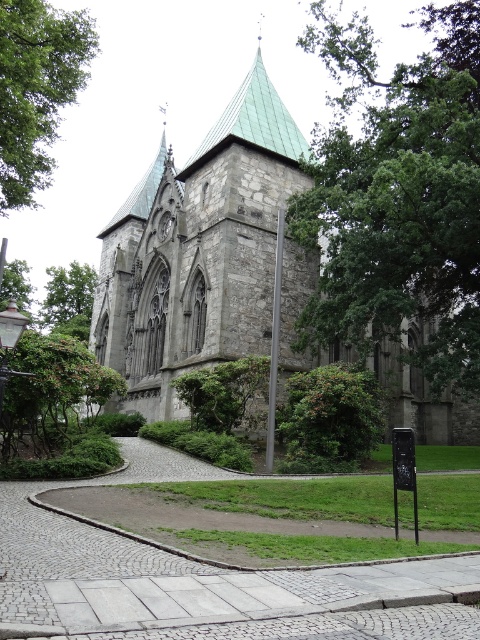
Question: Which point is farther to the camera?

Choices:
 (A) (6, 97)
 (B) (62, 376)
 (C) (333, 422)

Answer: (C)

Question: Does green leafy tree at upper right appear under green leafy tree at lower left?

Choices:
 (A) no
 (B) yes

Answer: (A)

Question: Estimate the real-world distances between objects in this image. Which object is farther from the green leafy tree at lower left?

Choices:
 (A) green leafy bush at center
 (B) green leafy tree at upper left

Answer: (A)

Question: Which object is the farthest from the green leafy bush at center?

Choices:
 (A) green leafy tree at upper right
 (B) green leafy tree at lower left
 (C) cobblestone path at center

Answer: (B)

Question: Can you confirm if cobblestone path at center is wider than green leafy tree at upper left?

Choices:
 (A) no
 (B) yes

Answer: (B)

Question: Does green leafy tree at upper left have a lesser width compared to green leafy bush at lower left?

Choices:
 (A) yes
 (B) no

Answer: (B)